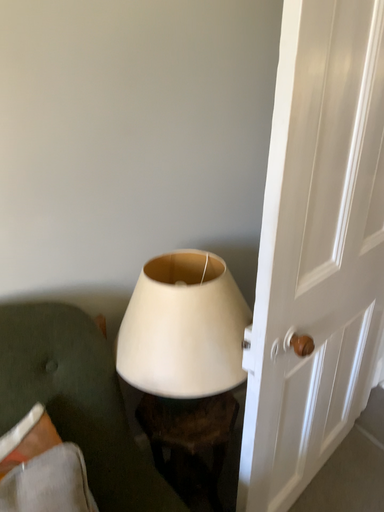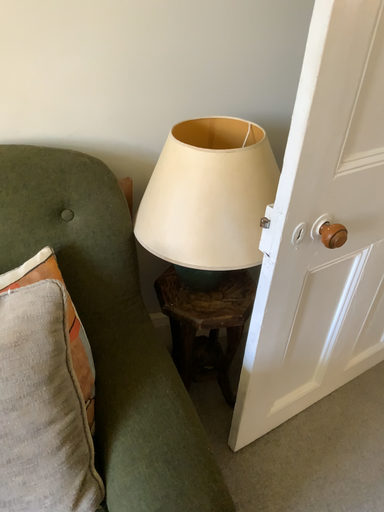
Question: Which way did the camera rotate in the video?

Choices:
 (A) rotated left
 (B) rotated right

Answer: (A)